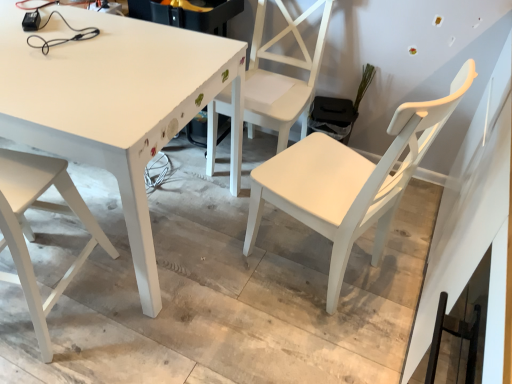
You are a GUI agent. You are given a task and a screenshot of the screen. Output one action in this format:
    pyautogui.click(x=<x>, y=<y>)
    Task: Click on the blank space to the left of white matte chair at center, which appears as the 1th chair when viewed from the right
    
    Given the screenshot: What is the action you would take?
    pyautogui.click(x=218, y=282)